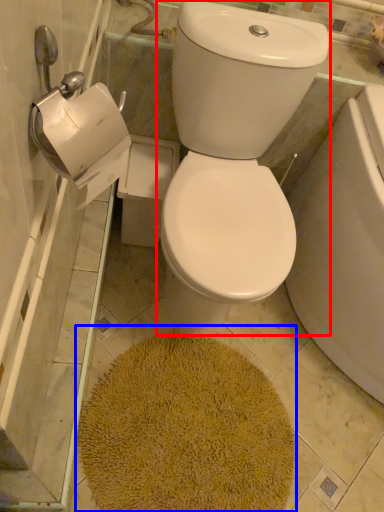
Question: Which object appears farthest to the camera in this image, toilet bowl (highlighted by a red box) or bath mat (highlighted by a blue box)?

Choices:
 (A) toilet bowl
 (B) bath mat

Answer: (B)